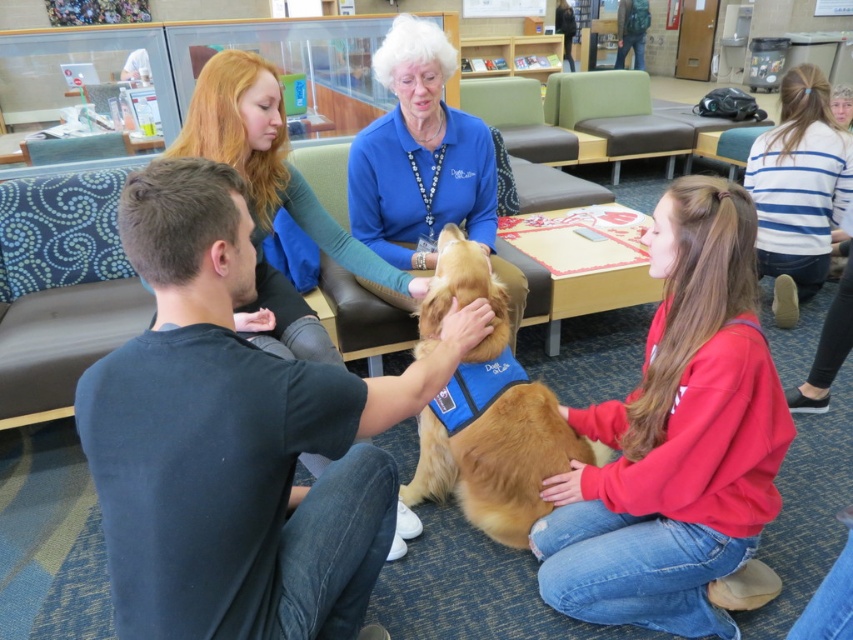
Can you confirm if golden fur dog at center is shorter than blue striped sweater at upper right?

Indeed, golden fur dog at center has a lesser height compared to blue striped sweater at upper right.

Does golden fur dog at center appear over blue striped sweater at upper right?

No, golden fur dog at center is not above blue striped sweater at upper right.

This screenshot has height=640, width=853. Find the location of `golden fur dog at center`. golden fur dog at center is located at coordinates (486, 412).

Image resolution: width=853 pixels, height=640 pixels. Find the location of `golden fur dog at center`. golden fur dog at center is located at coordinates (486, 412).

From the picture: Does dark blue shirt at center appear under blue striped sweater at upper right?

Yes.

Can you confirm if dark blue shirt at center is bigger than blue striped sweater at upper right?

Correct, dark blue shirt at center is larger in size than blue striped sweater at upper right.

Image resolution: width=853 pixels, height=640 pixels. Identify the location of dark blue shirt at center. (236, 438).

The height and width of the screenshot is (640, 853). I want to click on dark blue shirt at center, so click(x=236, y=438).

Is red fleece sweatshirt at lower right smaller than golden fur dog at center?

Actually, red fleece sweatshirt at lower right might be larger than golden fur dog at center.

Is red fleece sweatshirt at lower right below golden fur dog at center?

Indeed, red fleece sweatshirt at lower right is positioned under golden fur dog at center.

Image resolution: width=853 pixels, height=640 pixels. In order to click on red fleece sweatshirt at lower right in this screenshot , I will do `click(675, 438)`.

Where is `red fleece sweatshirt at lower right`? red fleece sweatshirt at lower right is located at coordinates (675, 438).